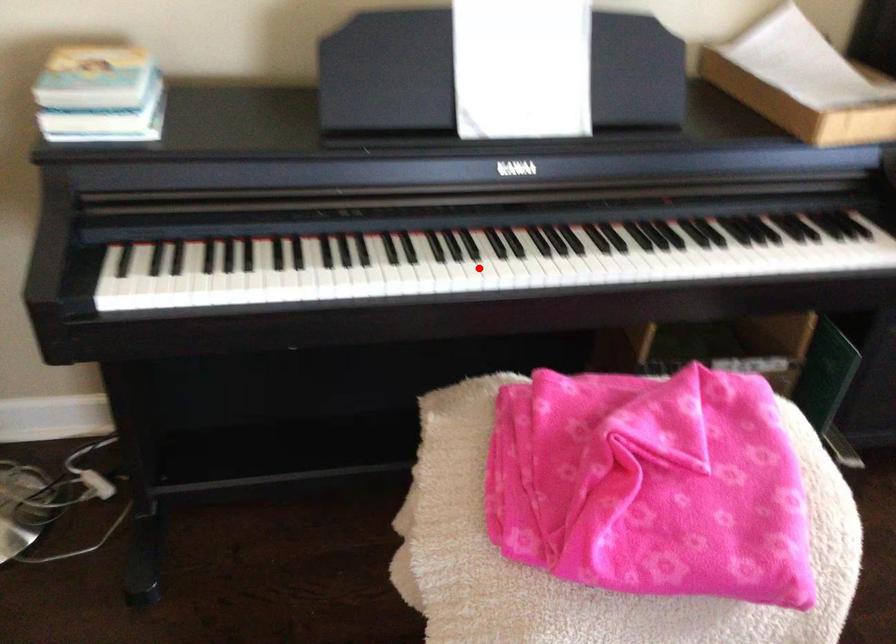
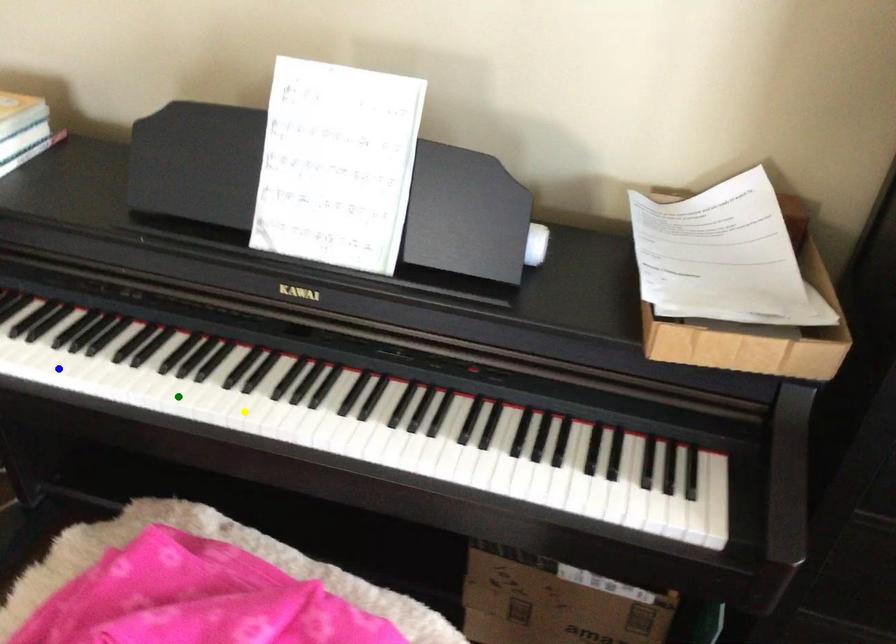
Question: I am providing you with two images of the same scene from different viewpoints. A red point is marked on the first image. You are given multiple points on the second image. Which point in image 2 represents the same 3d spot as the red point in image 1?

Choices:
 (A) blue point
 (B) yellow point
 (C) green point

Answer: (C)